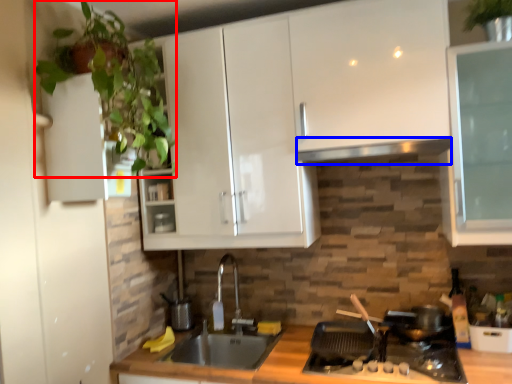
Question: Which of the following is the farthest to the observer, plant (highlighted by a red box) or exhaust hood (highlighted by a blue box)?

Choices:
 (A) plant
 (B) exhaust hood

Answer: (B)